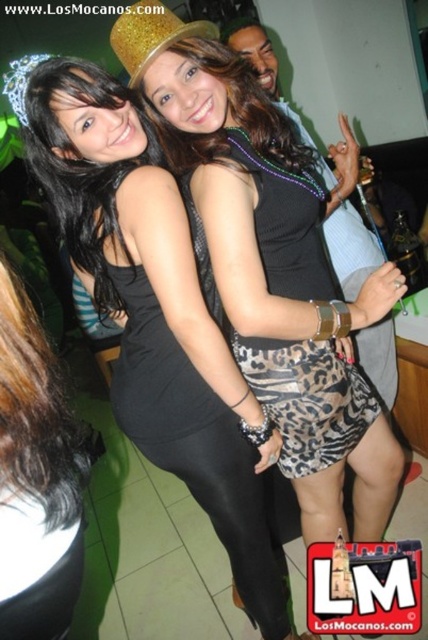
Can you confirm if black matte hair at lower left is positioned above leopard print skirt at center?

No, black matte hair at lower left is not above leopard print skirt at center.

This screenshot has width=428, height=640. What do you see at coordinates (36, 474) in the screenshot?
I see `black matte hair at lower left` at bounding box center [36, 474].

Where is `black matte hair at lower left`? The image size is (428, 640). black matte hair at lower left is located at coordinates (36, 474).

Where is `black matte dress at center`? This screenshot has width=428, height=640. black matte dress at center is located at coordinates (158, 316).

Is black matte dress at center to the left of leopard print skirt at center from the viewer's perspective?

Indeed, black matte dress at center is positioned on the left side of leopard print skirt at center.

Which is in front, point (172, 232) or point (265, 404)?

Point (172, 232)

Find the location of `black matte dress at center`. black matte dress at center is located at coordinates (158, 316).

Between leopard print skirt at center and silver metallic tiara at upper left, which one has more height?

With more height is leopard print skirt at center.

Between point (284, 285) and point (23, 106), which one is positioned in front?

Point (23, 106) is in front.

Does point (317, 269) lie behind point (23, 97)?

Yes, point (317, 269) is farther from viewer.

Image resolution: width=428 pixels, height=640 pixels. What are the coordinates of `leopard print skirt at center` in the screenshot? It's located at (306, 397).